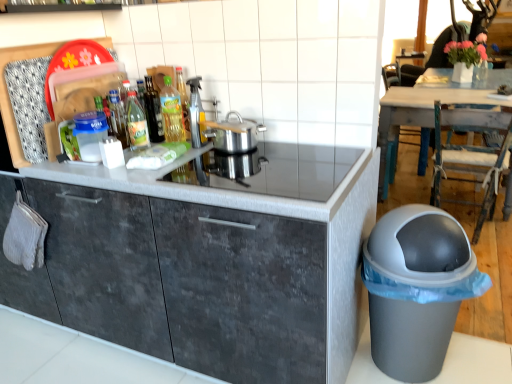
Question: Is gray plastic waste bin at lower right taller than silver metallic pot at center?

Choices:
 (A) no
 (B) yes

Answer: (B)

Question: Can you confirm if gray plastic waste bin at lower right is positioned to the right of silver metallic pot at center?

Choices:
 (A) yes
 (B) no

Answer: (A)

Question: Is gray plastic waste bin at lower right looking in the opposite direction of silver metallic pot at center?

Choices:
 (A) yes
 (B) no

Answer: (B)

Question: Considering the relative sizes of gray plastic waste bin at lower right and silver metallic pot at center in the image provided, is gray plastic waste bin at lower right shorter than silver metallic pot at center?

Choices:
 (A) yes
 (B) no

Answer: (B)

Question: Is gray plastic waste bin at lower right further to the viewer compared to silver metallic pot at center?

Choices:
 (A) no
 (B) yes

Answer: (A)

Question: Considering the positions of wooden rustic table at upper right and translucent plastic spray bottle at center in the image, is wooden rustic table at upper right bigger or smaller than translucent plastic spray bottle at center?

Choices:
 (A) big
 (B) small

Answer: (A)

Question: From the image's perspective, is wooden rustic table at upper right located above or below translucent plastic spray bottle at center?

Choices:
 (A) below
 (B) above

Answer: (B)

Question: Is wooden rustic table at upper right taller or shorter than translucent plastic spray bottle at center?

Choices:
 (A) tall
 (B) short

Answer: (A)

Question: Is wooden rustic table at upper right in front of or behind translucent plastic spray bottle at center in the image?

Choices:
 (A) behind
 (B) front

Answer: (A)

Question: Visually, is translucent glass bottle at center, the 2th bottle from the left, positioned to the left or to the right of translucent glass bottle at center, which is counted as the third bottle, starting from the right?

Choices:
 (A) left
 (B) right

Answer: (B)

Question: In terms of width, does translucent glass bottle at center, the 2th bottle from the left, look wider or thinner when compared to translucent glass bottle at center, which is counted as the third bottle, starting from the right?

Choices:
 (A) thin
 (B) wide

Answer: (B)

Question: In the image, is translucent glass bottle at center, positioned as the second bottle in right-to-left order, positioned in front of or behind translucent glass bottle at center, which is counted as the third bottle, starting from the right?

Choices:
 (A) behind
 (B) front

Answer: (B)

Question: From a real-world perspective, is translucent glass bottle at center, the 2th bottle from the left, physically located above or below translucent glass bottle at center, placed as the 1th bottle when sorted from left to right?

Choices:
 (A) above
 (B) below

Answer: (B)

Question: Is wooden rustic table at upper right situated inside green glass bottle at center, placed as the 1th bottle when sorted from right to left, or outside?

Choices:
 (A) inside
 (B) outside

Answer: (B)

Question: Relative to green glass bottle at center, placed as the 1th bottle when sorted from right to left, is wooden rustic table at upper right in front or behind?

Choices:
 (A) front
 (B) behind

Answer: (B)